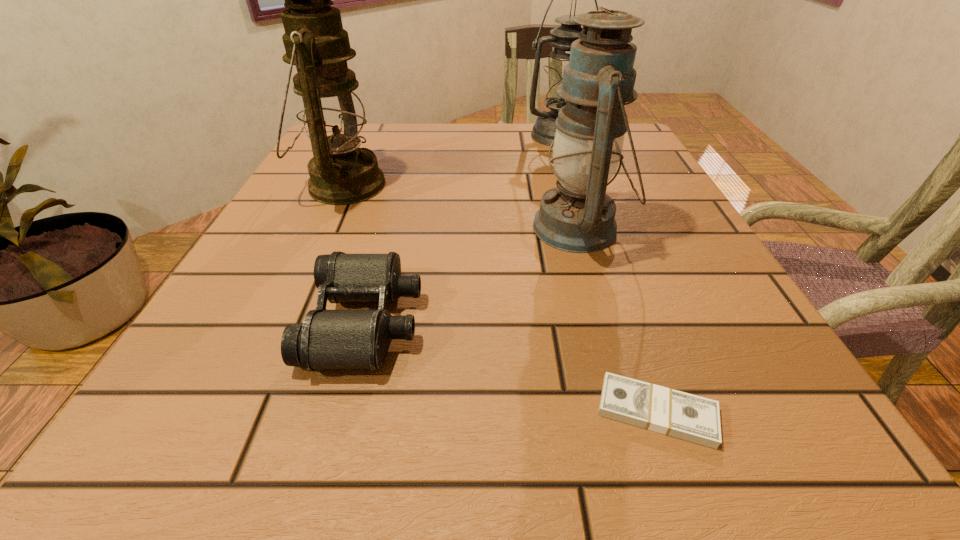
Identify the location of the farthest oil lamp. (561, 38).

You are a GUI agent. You are given a task and a screenshot of the screen. Output one action in this format:
    pyautogui.click(x=<x>, y=<y>)
    Task: Click on the leftmost oil lamp
    The image size is (960, 540).
    Given the screenshot: What is the action you would take?
    pyautogui.click(x=329, y=103)

Image resolution: width=960 pixels, height=540 pixels. I want to click on the fourth tallest object, so click(x=327, y=339).

At what (x,y) coordinates should I click in order to perform the action: click on dollar. Please return your answer as a coordinate pair (x, y). This screenshot has width=960, height=540. Looking at the image, I should click on (696, 419).

Identify the location of free space located on the left of the farthest oil lamp. (498, 136).

Find the location of a particular element. The image size is (960, 540). vacant space located 0.060m on the back of the leftmost oil lamp is located at coordinates (361, 148).

Identify the location of vacant area located through the eyepieces of the binoculars. (481, 321).

Find the location of a particular element. The width and height of the screenshot is (960, 540). blank area located 0.100m on the right of the dollar is located at coordinates (800, 411).

At what (x,y) coordinates should I click in order to perform the action: click on object located at the near edge. Please return your answer as a coordinate pair (x, y). This screenshot has width=960, height=540. Looking at the image, I should click on (696, 419).

This screenshot has height=540, width=960. Find the location of `oil lamp present at the left edge`. oil lamp present at the left edge is located at coordinates (329, 103).